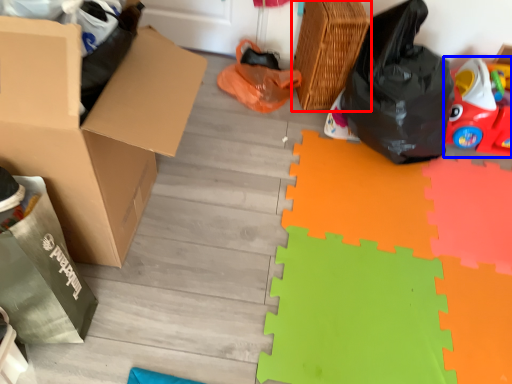
Question: Which object appears farthest to the camera in this image, basket (highlighted by a red box) or toy (highlighted by a blue box)?

Choices:
 (A) basket
 (B) toy

Answer: (B)